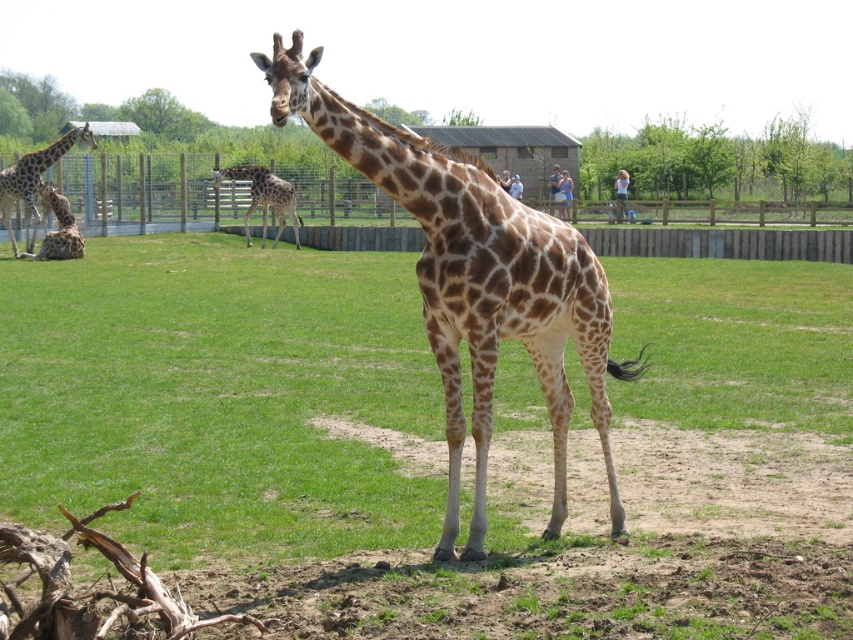
Question: Which of the following is the farthest from the observer?

Choices:
 (A) brown spotted giraffe at left
 (B) spotted fur giraffe at center
 (C) brown spotted giraffe at lower left
 (D) brown spotted giraffe at center

Answer: (B)

Question: Among these objects, which one is farthest from the camera?

Choices:
 (A) brown spotted giraffe at left
 (B) spotted fur giraffe at center

Answer: (B)

Question: Is brown spotted giraffe at center below brown spotted giraffe at left?

Choices:
 (A) no
 (B) yes

Answer: (B)

Question: Can you confirm if brown spotted giraffe at center is bigger than spotted fur giraffe at center?

Choices:
 (A) no
 (B) yes

Answer: (A)

Question: Estimate the real-world distances between objects in this image. Which object is farther from the brown spotted giraffe at center?

Choices:
 (A) spotted fur giraffe at center
 (B) brown spotted giraffe at lower left

Answer: (A)

Question: Is brown spotted giraffe at center smaller than brown spotted giraffe at left?

Choices:
 (A) yes
 (B) no

Answer: (A)